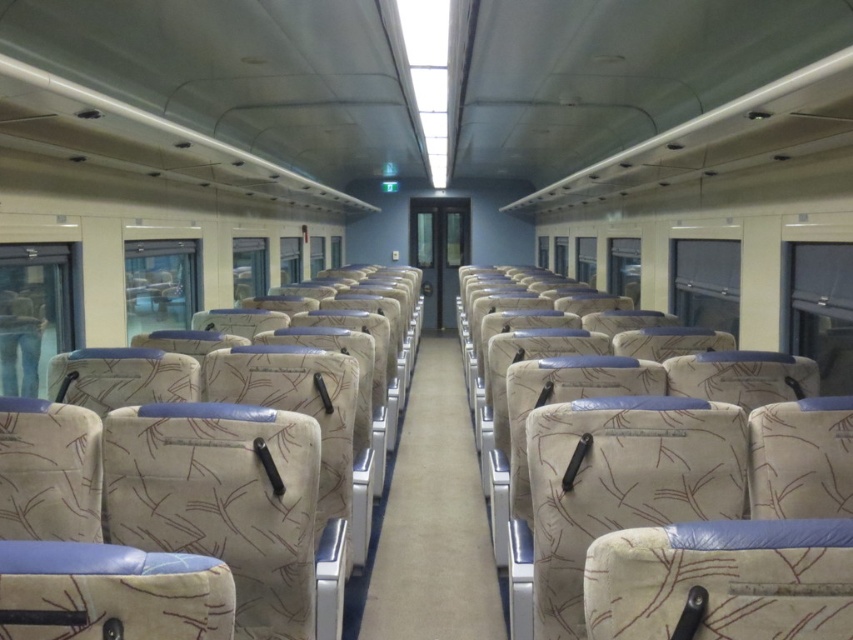
You are a passenger sitting in the train carriage. You need to reach the restroom, which is located at the end of the beige fabric aisle at center. However, there is a person wearing denim jeans at left blocking your path. Can you move around them to access the aisle?

The beige fabric aisle at center is below the denim jeans at left, meaning the denim jeans at left are positioned higher or above the aisle. Therefore, you can move around the person by going around them since they are not directly blocking the aisle itself.

You are a passenger sitting in the train carriage and want to reach the aisle. The beige fabric aisle at center is located at point (428, 522). Can you determine if you are currently sitting to the left or right of the beige fabric aisle at center?

The beige fabric aisle at center is located at point (428, 522). Since you are sitting in the train carriage, your position relative to the aisle depends on your seat location. Without knowing your exact seat coordinates, it is impossible to determine if you are to the left or right of the beige fabric aisle at center.